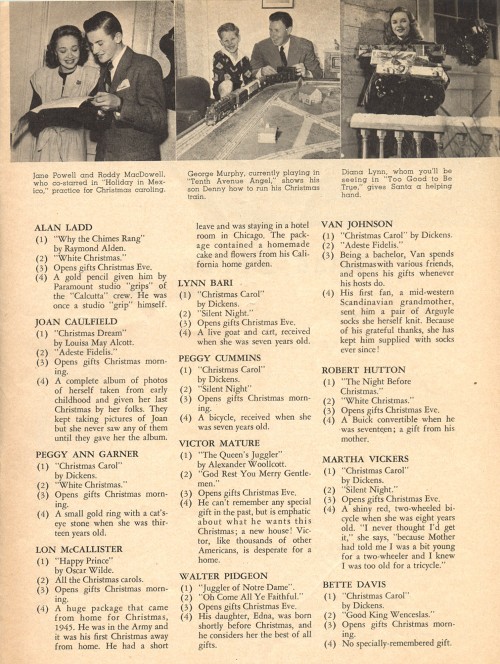
Identify the location of photographs. (82, 72), (262, 88), (408, 76).